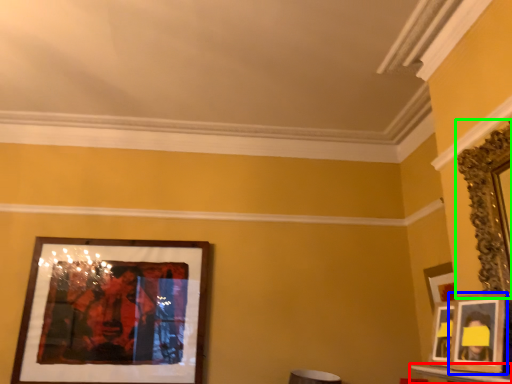
Question: Which object is the farthest from table (highlighted by a red box)? Choose among these: picture frame (highlighted by a blue box) or picture frame (highlighted by a green box).

Choices:
 (A) picture frame
 (B) picture frame

Answer: (B)